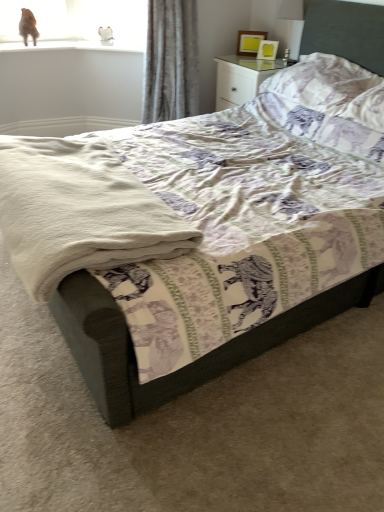
Question: Is white soft blanket at lower left far from matte yellow picture frame at upper right?

Choices:
 (A) no
 (B) yes

Answer: (B)

Question: Is white soft blanket at lower left shorter than matte yellow picture frame at upper right?

Choices:
 (A) yes
 (B) no

Answer: (A)

Question: Is white soft blanket at lower left positioned before matte yellow picture frame at upper right?

Choices:
 (A) yes
 (B) no

Answer: (A)

Question: Is white soft blanket at lower left positioned with its back to matte yellow picture frame at upper right?

Choices:
 (A) no
 (B) yes

Answer: (A)

Question: Does white soft blanket at lower left have a larger size compared to matte yellow picture frame at upper right?

Choices:
 (A) yes
 (B) no

Answer: (A)

Question: Does white soft blanket at lower left have a greater height compared to matte yellow picture frame at upper right?

Choices:
 (A) yes
 (B) no

Answer: (B)

Question: Does brown fur cat at upper left have a smaller size compared to white soft blanket at lower left?

Choices:
 (A) no
 (B) yes

Answer: (B)

Question: Is white soft blanket at lower left completely or partially inside brown fur cat at upper left?

Choices:
 (A) no
 (B) yes

Answer: (A)

Question: Is brown fur cat at upper left at the left side of white soft blanket at lower left?

Choices:
 (A) no
 (B) yes

Answer: (B)

Question: Is brown fur cat at upper left oriented towards white soft blanket at lower left?

Choices:
 (A) yes
 (B) no

Answer: (A)

Question: Is brown fur cat at upper left positioned with its back to white soft blanket at lower left?

Choices:
 (A) no
 (B) yes

Answer: (A)

Question: From the image's perspective, is brown fur cat at upper left over white soft blanket at lower left?

Choices:
 (A) yes
 (B) no

Answer: (A)

Question: Is the position of purple printed pillow at upper right less distant than that of brown fur cat at upper left?

Choices:
 (A) no
 (B) yes

Answer: (B)